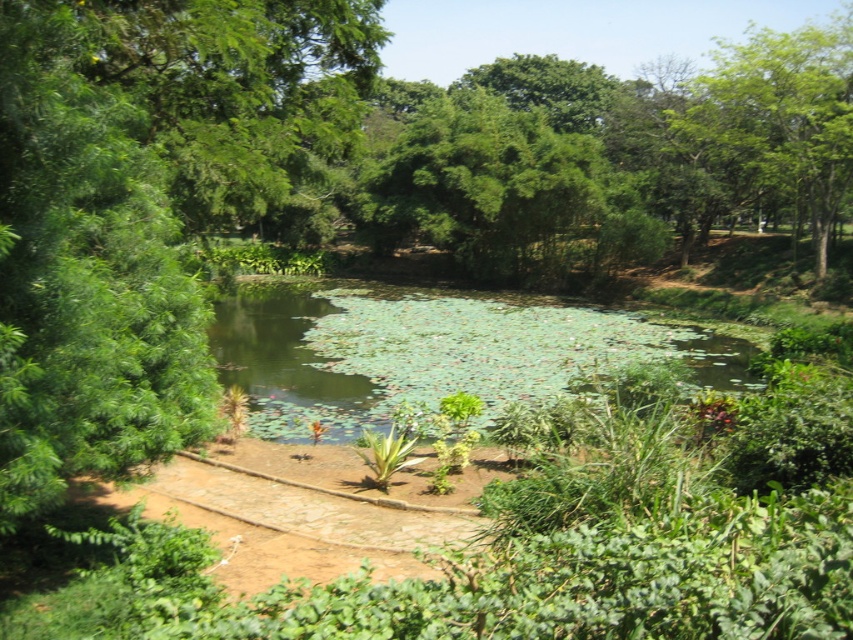
Between point (519, 305) and point (851, 32), which one is positioned behind?

Positioned behind is point (519, 305).

Is green leafy water at center wider than green leafy tree at upper right?

No, green leafy water at center is not wider than green leafy tree at upper right.

Which is in front, point (434, 400) or point (788, 51)?

Point (434, 400) is in front.

Locate an element on the screen. The height and width of the screenshot is (640, 853). green leafy water at center is located at coordinates (427, 353).